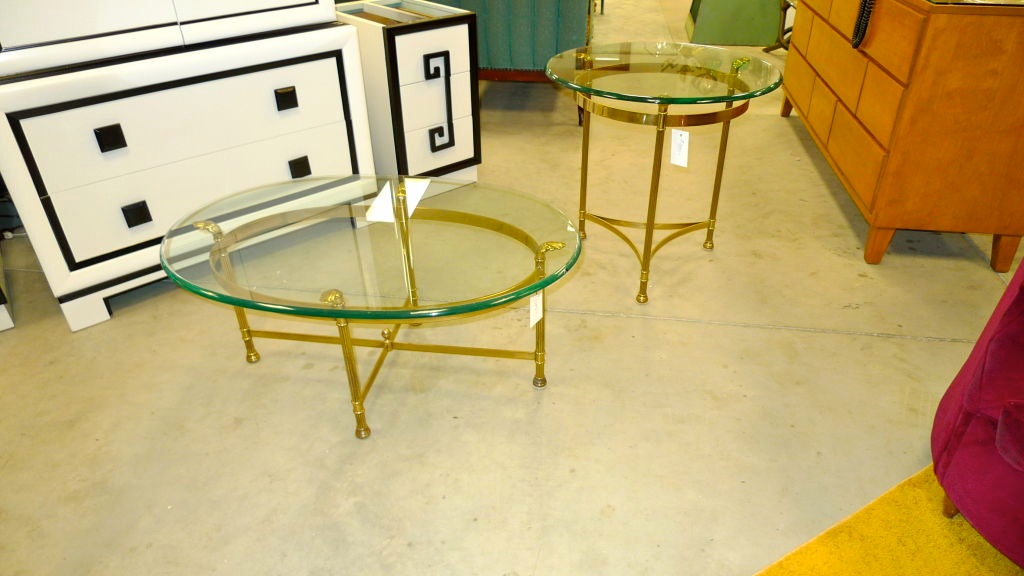
Locate an element on the screen. The height and width of the screenshot is (576, 1024). yellow rug is located at coordinates (874, 532).